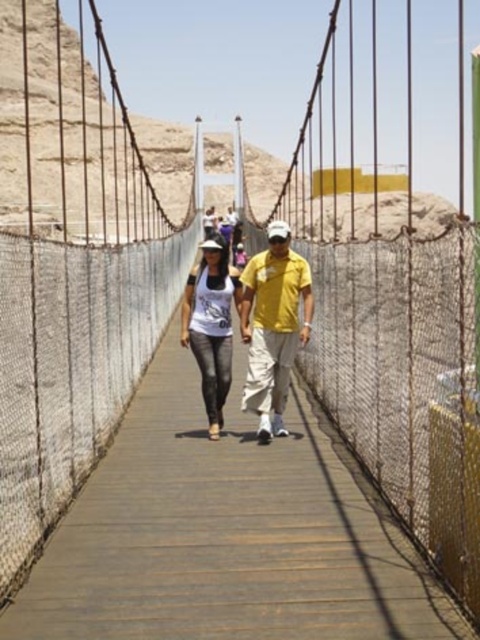
Can you confirm if yellow matte shirt at center is thinner than matte white tank top at center?

In fact, yellow matte shirt at center might be wider than matte white tank top at center.

Based on the photo, can you confirm if yellow matte shirt at center is positioned to the left of matte white tank top at center?

No, yellow matte shirt at center is not to the left of matte white tank top at center.

In order to click on yellow matte shirt at center in this screenshot , I will do `click(273, 324)`.